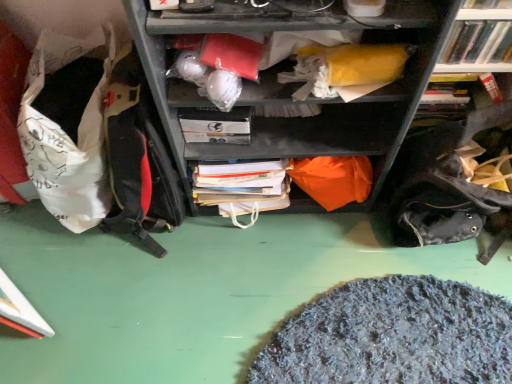
Question: From the image's perspective, is white plastic books at upper right above or below white matte paperback book at center?

Choices:
 (A) below
 (B) above

Answer: (B)

Question: Is white plastic books at upper right taller or shorter than white matte paperback book at center?

Choices:
 (A) short
 (B) tall

Answer: (B)

Question: Which object is positioned closest to the white plastic books at upper right?

Choices:
 (A) white matte paperback book at center
 (B) white fabric bean bag at left

Answer: (A)

Question: Which is farther from the white fabric bean bag at left?

Choices:
 (A) white matte paperback book at center
 (B) white plastic books at upper right

Answer: (B)